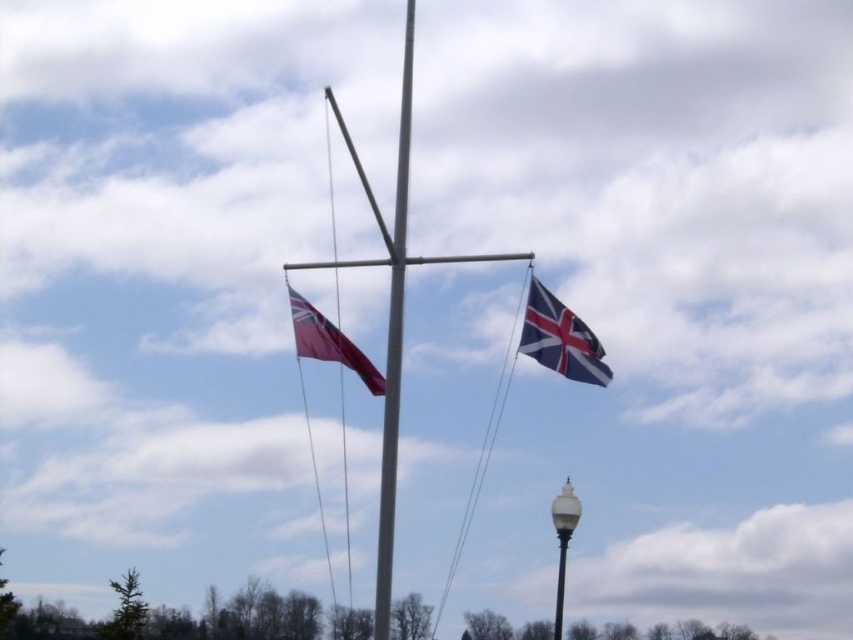
In the scene shown: You are a photographer trying to capture both the metallic pole at center and the polished blue and white fabric flag at upper right in the same frame. Based on their positions, which object should you focus on first to ensure both are in focus?

The metallic pole at center is positioned over the polished blue and white fabric flag at upper right, so focusing on the metallic pole at center first will help ensure both are in focus since it is closer to the camera.